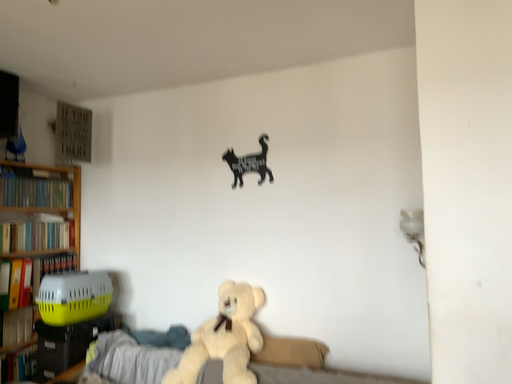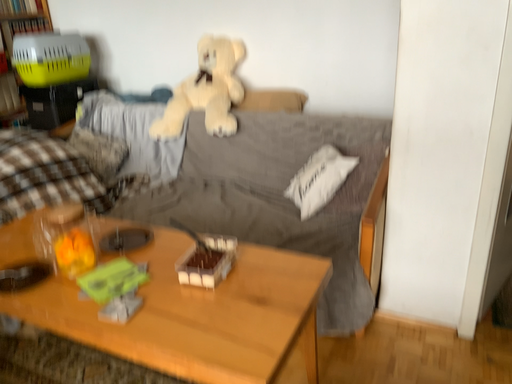
Question: How did the camera likely rotate when shooting the video?

Choices:
 (A) rotated downward
 (B) rotated upward

Answer: (A)